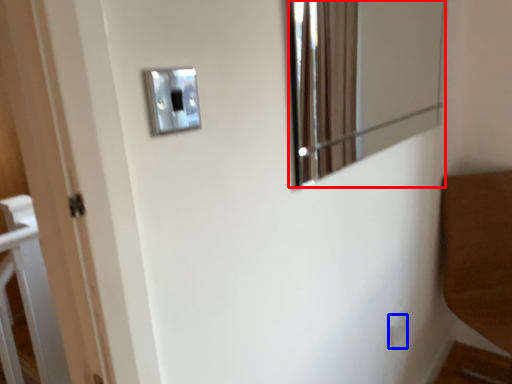
Question: Which object is further to the camera taking this photo, mirror (highlighted by a red box) or light switch (highlighted by a blue box)?

Choices:
 (A) mirror
 (B) light switch

Answer: (B)